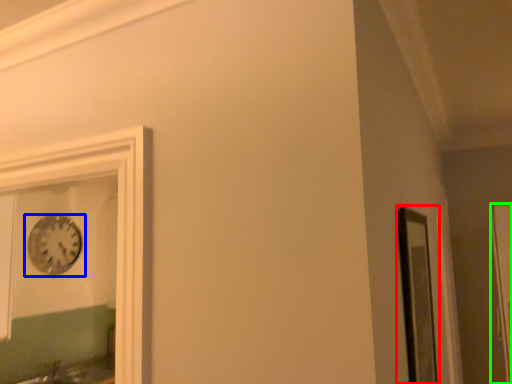
Question: Considering the real-world distances, which object is farthest from window frame (highlighted by a red box)? wall clock (highlighted by a blue box) or glass door (highlighted by a green box)?

Choices:
 (A) wall clock
 (B) glass door

Answer: (A)